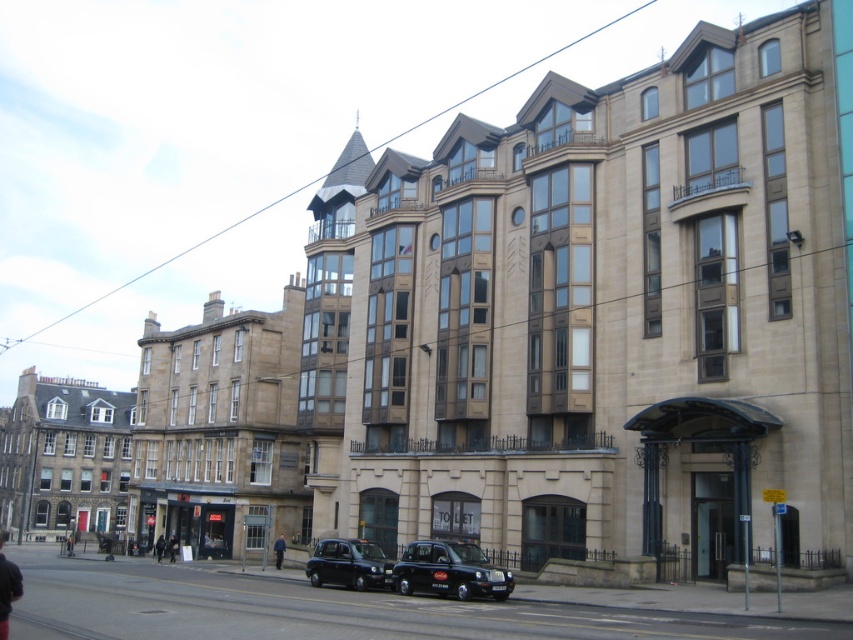
You are standing at the crosswalk located at the bottom edge of the image. You want to hail a taxi. Which direction should you walk to reach the black metallic taxi at center?

Since the black metallic taxi at center is located at point 0.894 on the x axis and 0.528 on the y axis, you should walk towards the center of the image to reach it from the crosswalk at the bottom edge.

You are standing on the sidewalk in front of the large beige stone building and want to take a photo of the pointed tower at the top left corner. You notice two points marked on the ground at coordinates point (463, 566) and point (381, 584). Which point should you stand closer to in order to have the tower fill more of your camera frame?

You should stand closer to point (463, 566) because it is closer to the camera than point (381, 584), allowing the tower to appear larger in the camera frame.

You are a pedestrian standing on the sidewalk in front of the large beige stone building. You see two taxis parked at the center of the street. Which taxi is closer to the building? The black metallic taxi at center or the matte black taxi at center?

The black metallic taxi at center is to the right of the matte black taxi at center. Since both are parked at the center of the street, their distance from the building would depend on their position along the curb. However, the description specifies their relative positioning left to right, so we cannot determine which is closer to the building based on the given information.